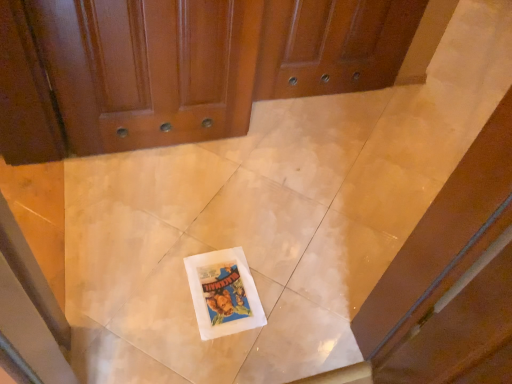
Where is `vacant space to the right of glossy wood door at upper center`? The height and width of the screenshot is (384, 512). vacant space to the right of glossy wood door at upper center is located at coordinates (265, 172).